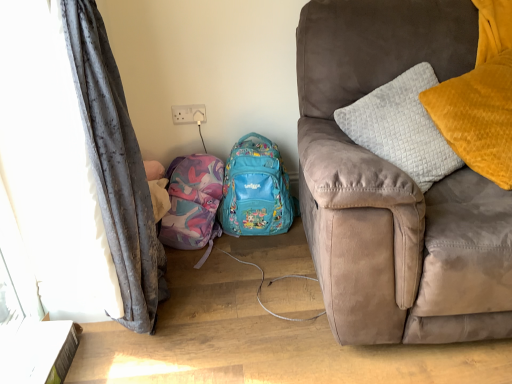
Question: Would you say suede couch at right is part of teal fabric backpack at center, the first backpack positioned from the right,'s contents?

Choices:
 (A) no
 (B) yes

Answer: (A)

Question: Is teal fabric backpack at center, which is the 2th backpack in left-to-right order, at the right side of suede couch at right?

Choices:
 (A) no
 (B) yes

Answer: (A)

Question: Is teal fabric backpack at center, which is the 2th backpack in left-to-right order, turned away from suede couch at right?

Choices:
 (A) yes
 (B) no

Answer: (B)

Question: From a real-world perspective, is teal fabric backpack at center, the first backpack positioned from the right, on suede couch at right?

Choices:
 (A) no
 (B) yes

Answer: (A)

Question: Could you tell me if teal fabric backpack at center, which is the 2th backpack in left-to-right order, is turned towards suede couch at right?

Choices:
 (A) no
 (B) yes

Answer: (A)

Question: Is teal fabric backpack at center, which is the 2th backpack in left-to-right order, not near suede couch at right?

Choices:
 (A) yes
 (B) no

Answer: (B)

Question: From the image's perspective, is matte pink fabric backpack at lower left, placed as the 2th backpack when sorted from right to left, on velvet yellow pillow at right?

Choices:
 (A) no
 (B) yes

Answer: (A)

Question: Does matte pink fabric backpack at lower left, which ranks as the first backpack in left-to-right order, lie behind velvet yellow pillow at right?

Choices:
 (A) yes
 (B) no

Answer: (A)

Question: From a real-world perspective, does matte pink fabric backpack at lower left, placed as the 2th backpack when sorted from right to left, stand above velvet yellow pillow at right?

Choices:
 (A) yes
 (B) no

Answer: (B)

Question: Does matte pink fabric backpack at lower left, placed as the 2th backpack when sorted from right to left, have a lesser height compared to velvet yellow pillow at right?

Choices:
 (A) no
 (B) yes

Answer: (B)

Question: Could you tell me if matte pink fabric backpack at lower left, which ranks as the first backpack in left-to-right order, is turned towards velvet yellow pillow at right?

Choices:
 (A) yes
 (B) no

Answer: (B)

Question: Is the depth of matte pink fabric backpack at lower left, placed as the 2th backpack when sorted from right to left, less than that of velvet yellow pillow at right?

Choices:
 (A) yes
 (B) no

Answer: (B)

Question: Is gray fabric curtain at left smaller than teal fabric backpack at center, which is the 2th backpack in left-to-right order?

Choices:
 (A) no
 (B) yes

Answer: (A)